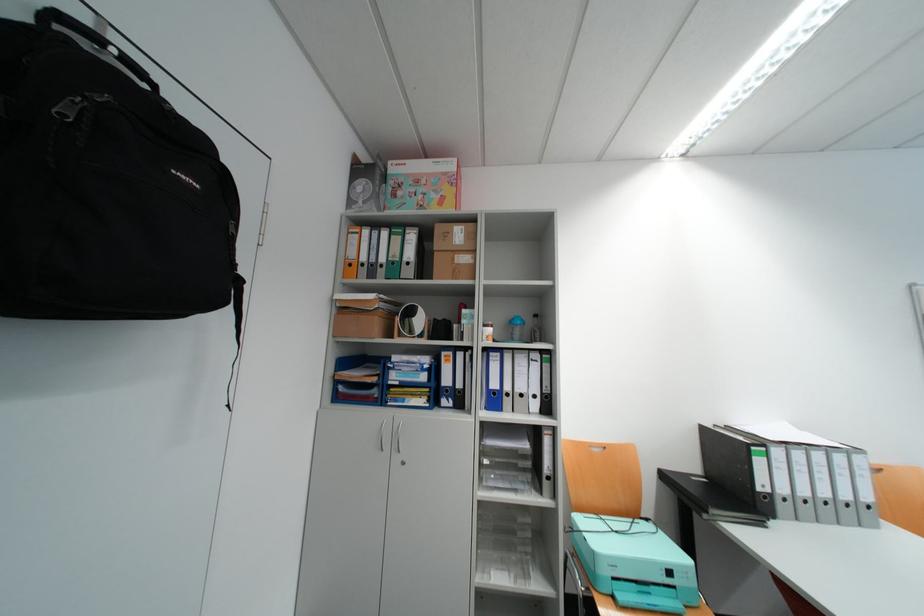
Where is `green binder spine hole`? green binder spine hole is located at coordinates (390, 260).